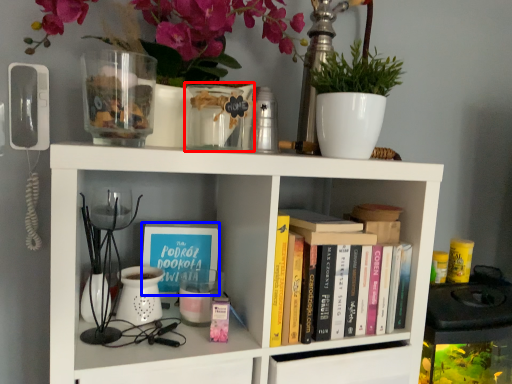
Question: Which of the following is the closest to the observer, glass vase (highlighted by a red box) or book cover (highlighted by a blue box)?

Choices:
 (A) glass vase
 (B) book cover

Answer: (A)